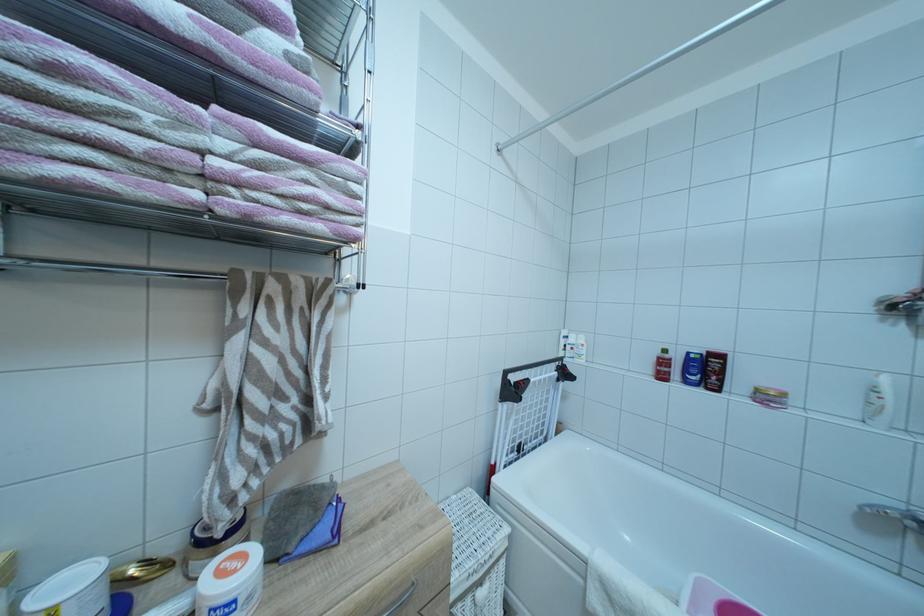
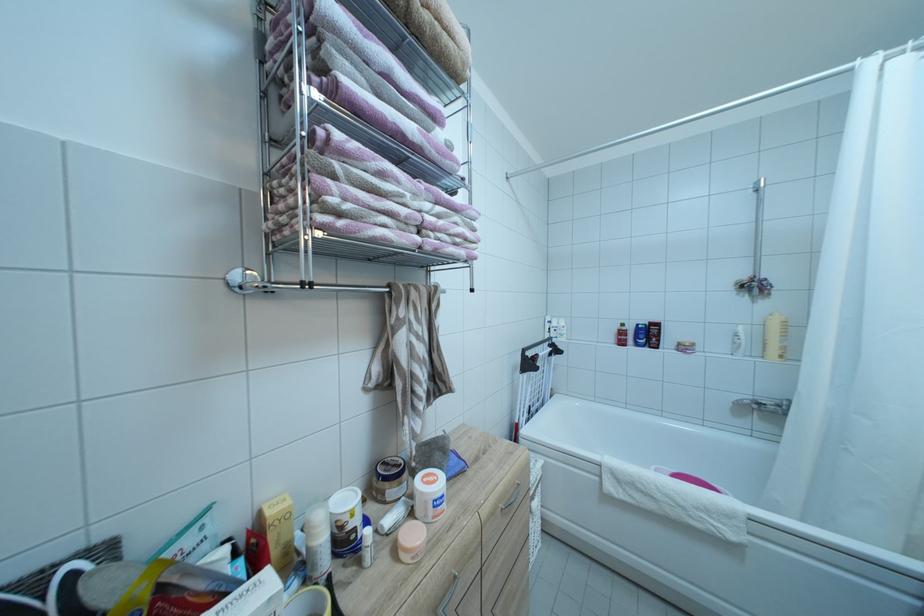
Locate, in the second image, the point that corresponds to pixel 249 169 in the first image.

(440, 221)